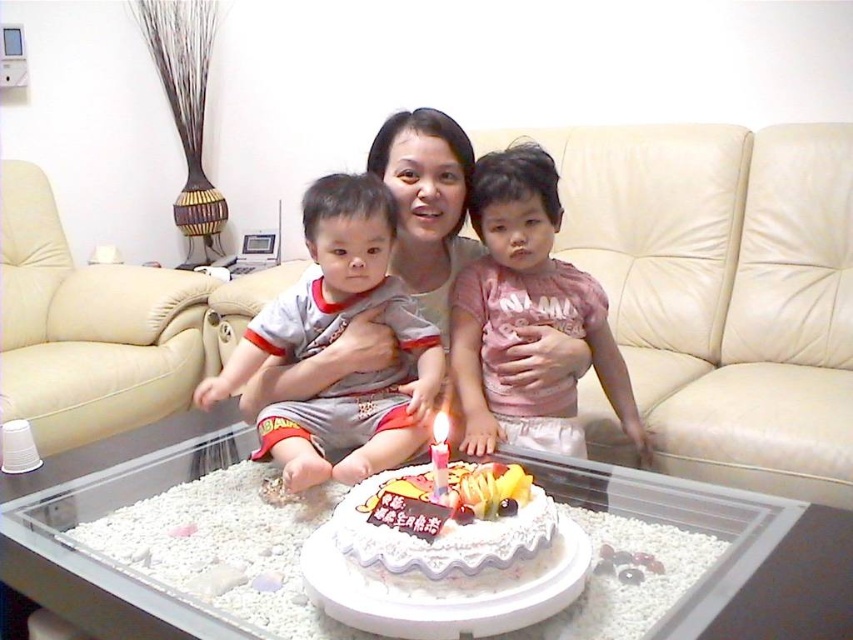
You are planning to place a rectangular gift box that is 1.2 meters long on the table between the beige leather couch at left and the white frosted cake at center. Can the table accommodate the gift box without it extending beyond the edges?

The beige leather couch at left might be wider than the white frosted cake at center, but the exact dimensions of the table are not provided. Without knowing the table length, it is uncertain if the 1.2 meter gift box will fit.

You are a photographer setting up for a family photo. You notice the gray cotton shirt at center and the pink cotton shirt at center. Which shirt should you adjust to ensure it is in focus if you want the one closer to the camera to be sharp?

You should ensure the gray cotton shirt at center is in focus because it is closer to the viewer than the pink cotton shirt at center.

You are organizing a closet and see the gray cotton shirt at center and the pink cotton shirt at center. Which shirt should you place on the left side of the shelf to match their current positions?

The gray cotton shirt at center should be placed on the left side of the shelf since it is currently to the left of the pink cotton shirt at center.